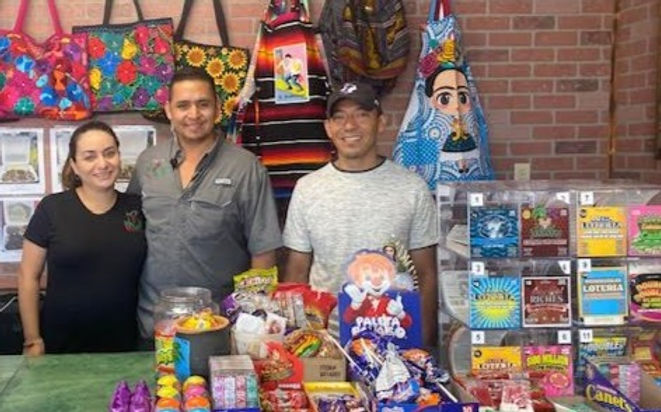
I want to click on table, so click(x=94, y=373).